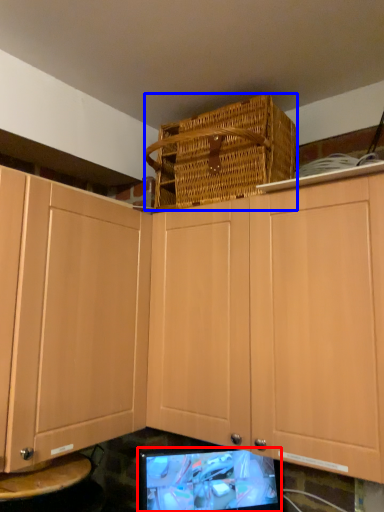
Question: Among these objects, which one is nearest to the camera, computer monitor (highlighted by a red box) or basket (highlighted by a blue box)?

Choices:
 (A) computer monitor
 (B) basket

Answer: (B)